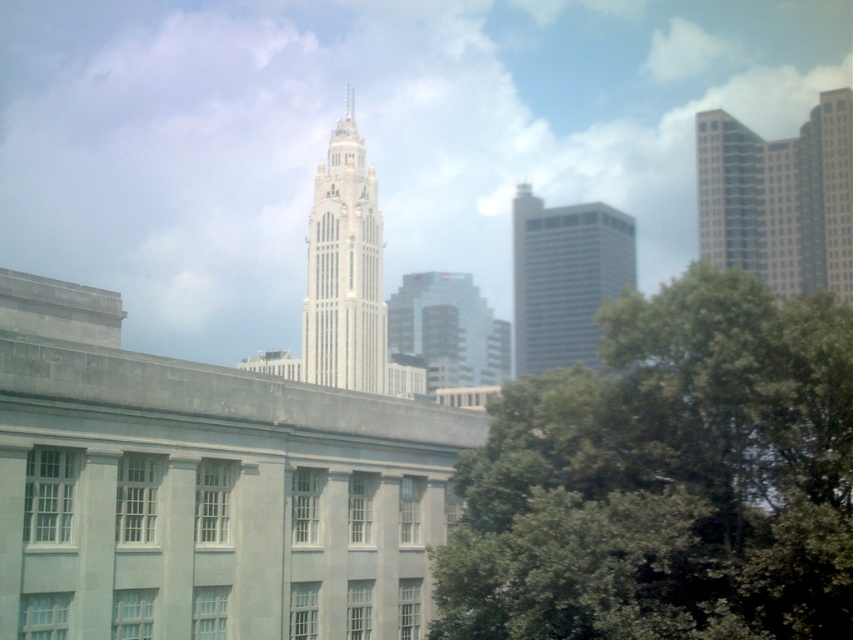
Question: Considering the relative positions of glassy blue skyscraper at upper right and gray glass building at center in the image provided, where is glassy blue skyscraper at upper right located with respect to gray glass building at center?

Choices:
 (A) above
 (B) below

Answer: (A)

Question: Which point is closer to the camera?

Choices:
 (A) green leafy tree at center
 (B) gray glass building at center
 (C) white glass tower at center

Answer: (A)

Question: Which object is closer to the camera taking this photo?

Choices:
 (A) gray glass building at center
 (B) white glass spire at upper center

Answer: (B)

Question: Can you confirm if glassy blue skyscraper at upper right is positioned to the left of gray glass building at center?

Choices:
 (A) yes
 (B) no

Answer: (B)

Question: Does gray glass building at center have a lesser width compared to glassy reflective skyscraper at center?

Choices:
 (A) no
 (B) yes

Answer: (B)

Question: Which point appears farthest from the camera in this image?

Choices:
 (A) (346, 109)
 (B) (502, 355)

Answer: (A)